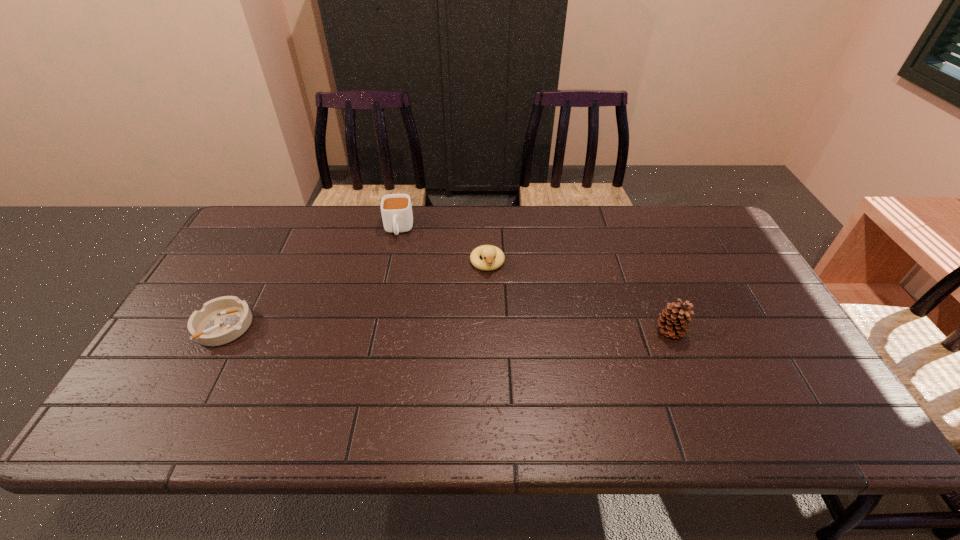
Locate an element on the screen. vacant space at the left edge of the desktop is located at coordinates (190, 353).

I want to click on vacant space at the right edge of the desktop, so click(x=697, y=259).

Identify the location of vacant area at the far left corner of the desktop. This screenshot has width=960, height=540. click(x=269, y=246).

Identify the location of vacant point located between the third nearest object and the rightmost object. (579, 297).

This screenshot has width=960, height=540. In order to click on vacant area that lies between the third object from right to left and the pinecone in this screenshot , I will do `click(534, 281)`.

Identify the location of vacant region between the farthest object and the ashtray. (311, 278).

Where is `empty location between the second object from left to right and the tallest object`? The width and height of the screenshot is (960, 540). empty location between the second object from left to right and the tallest object is located at coordinates (534, 281).

At what (x,y) coordinates should I click in order to perform the action: click on free space between the cup and the duckling. Please return your answer as a coordinate pair (x, y). This screenshot has width=960, height=540. Looking at the image, I should click on (443, 246).

Find the location of a particular element. Image resolution: width=960 pixels, height=540 pixels. empty space that is in between the third object from right to left and the rightmost object is located at coordinates (534, 281).

Where is `vacant space that's between the farthest object and the pinecone`? vacant space that's between the farthest object and the pinecone is located at coordinates (534, 281).